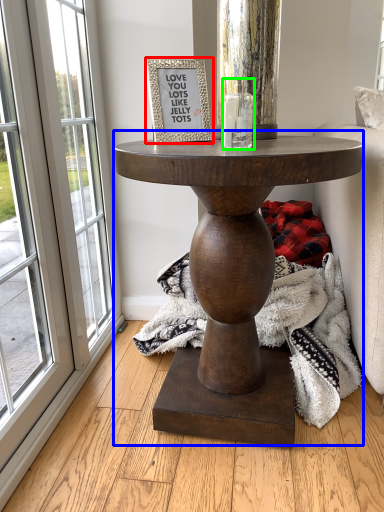
Question: Which object is positioned closest to picture frame (highlighted by a red box)? Select from table (highlighted by a blue box) and candle holder (highlighted by a green box).

Choices:
 (A) table
 (B) candle holder

Answer: (B)